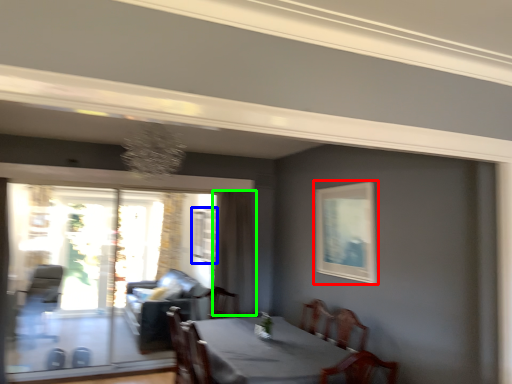
Question: Considering the real-world distances, which object is closest to picture frame (highlighted by a red box)? window (highlighted by a blue box) or curtain (highlighted by a green box).

Choices:
 (A) window
 (B) curtain

Answer: (B)